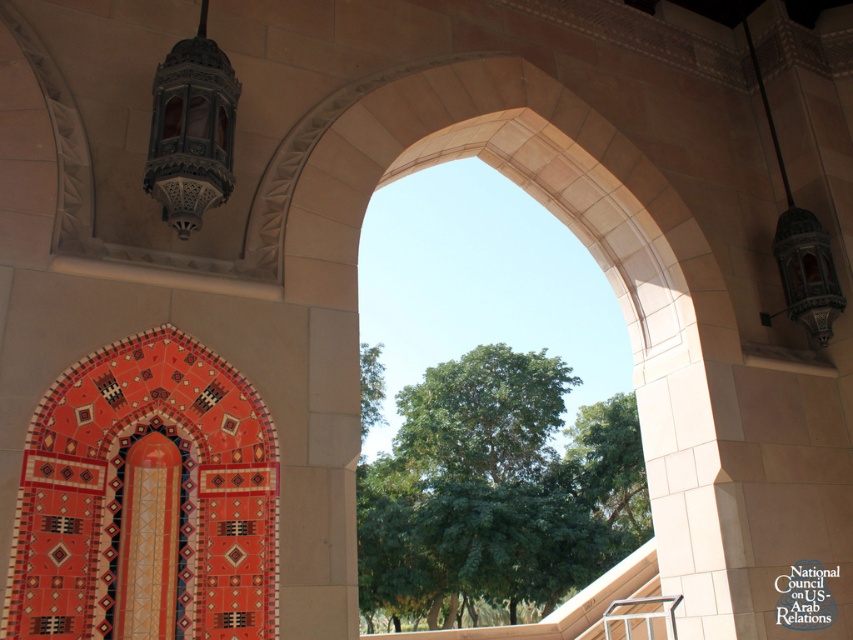
Can you confirm if matte metal lantern at upper left is thinner than matte orange tile at center?

Incorrect, matte metal lantern at upper left's width is not less than matte orange tile at center's.

Who is more forward, (225, 77) or (137, 582)?

Point (137, 582)

Between point (206, 152) and point (137, 460), which one is positioned behind?

Positioned behind is point (206, 152).

At what (x,y) coordinates should I click in order to perform the action: click on matte metal lantern at upper left. Please return your answer as a coordinate pair (x, y). Looking at the image, I should click on (190, 131).